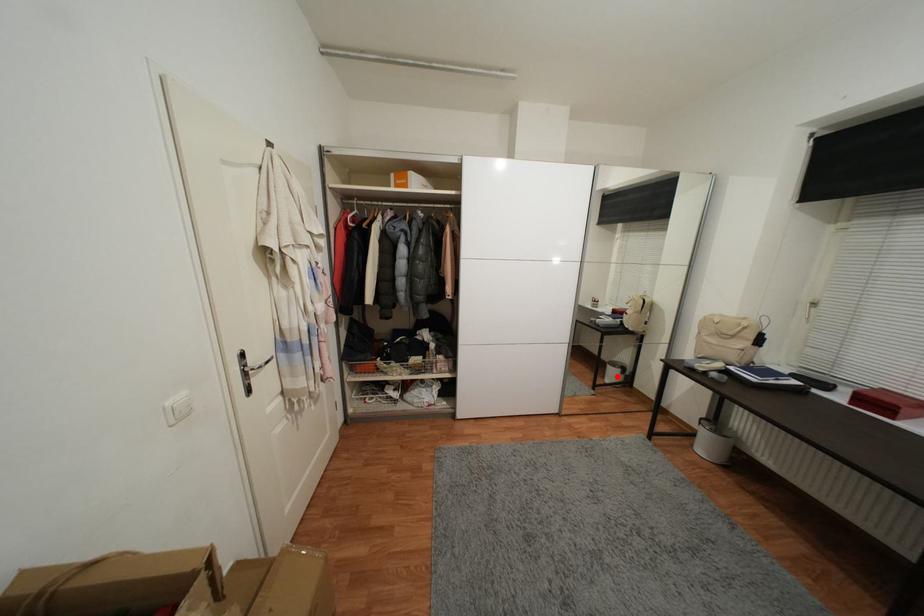
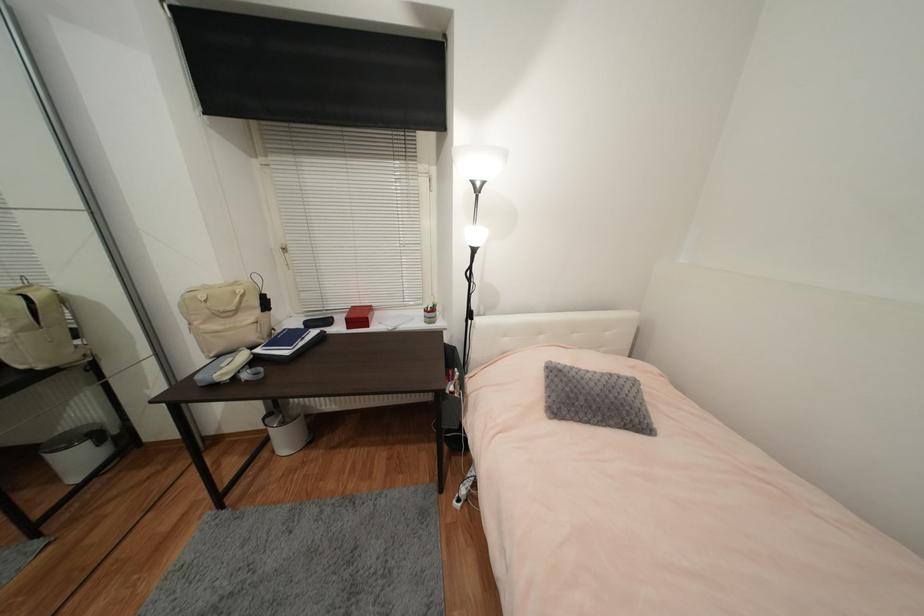
In the second image, find the point that corresponds to the highlighted location in the first image.

(83, 462)